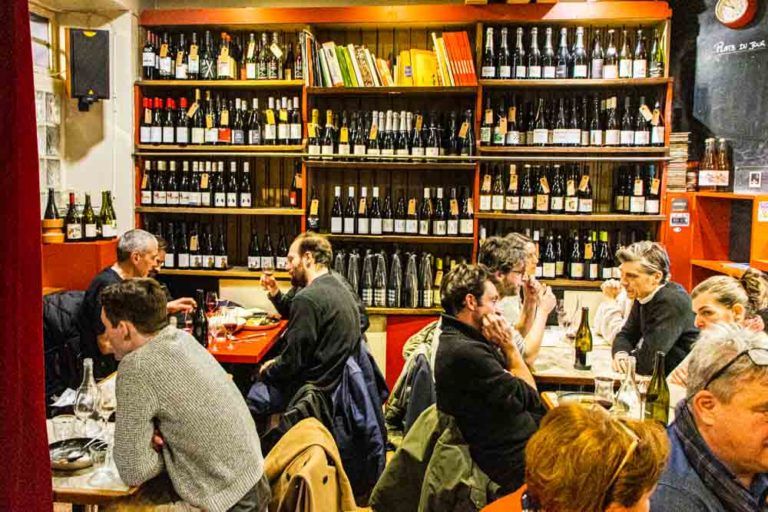
At what (x,y) coordinates should I click in order to perform the action: click on shelf. Please return your answer as a coordinate pair (x, y). Looking at the image, I should click on (343, 186).